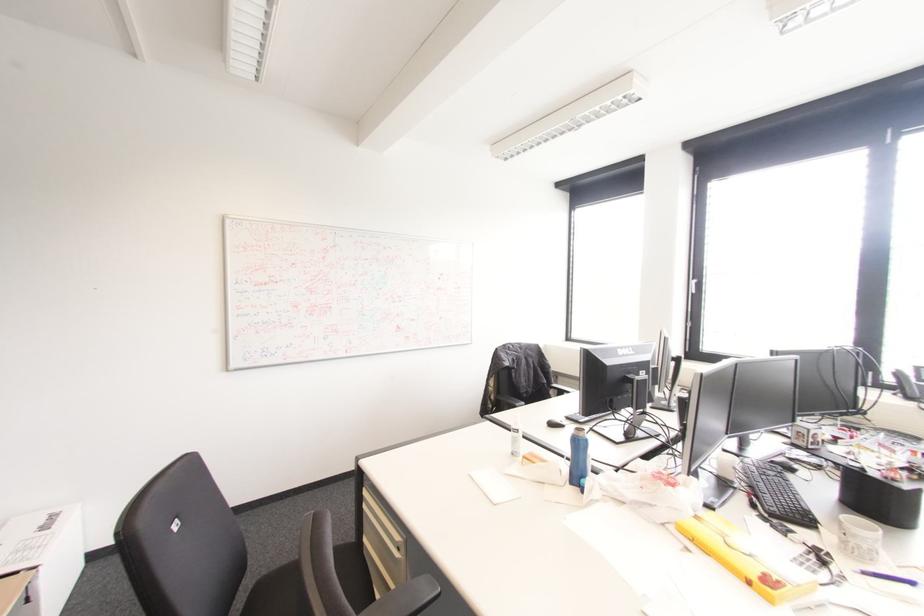
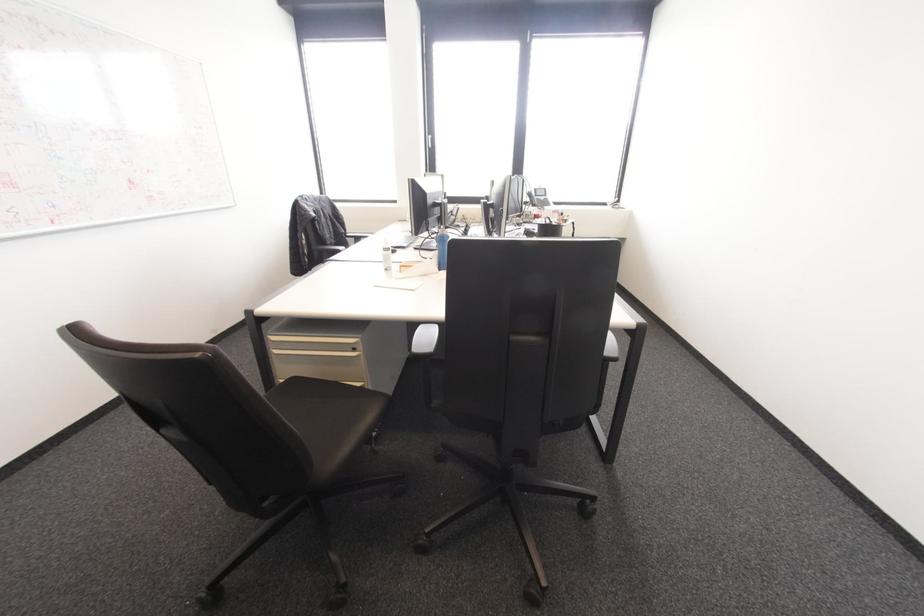
The point at (514, 406) is marked in the first image. Where is the corresponding point in the second image?

(337, 251)